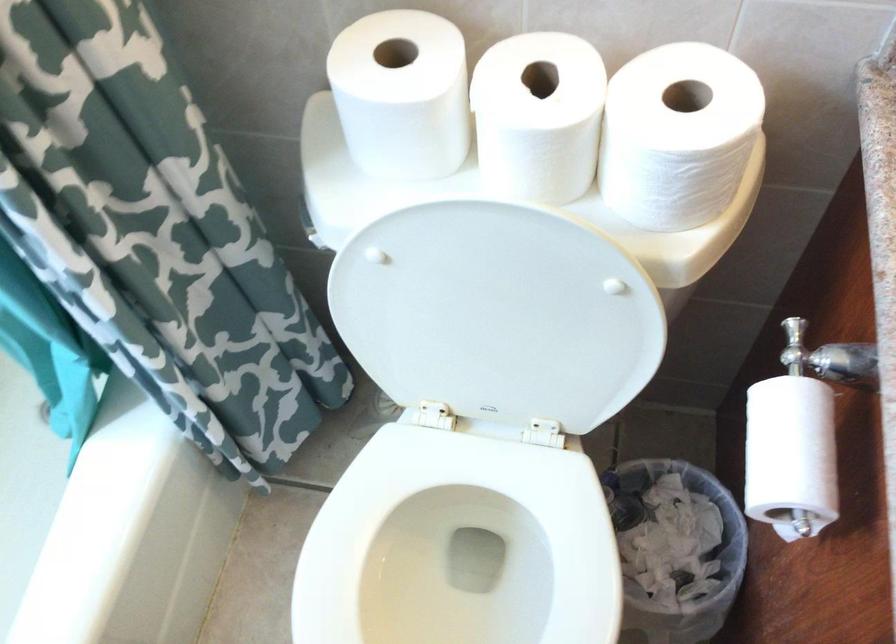
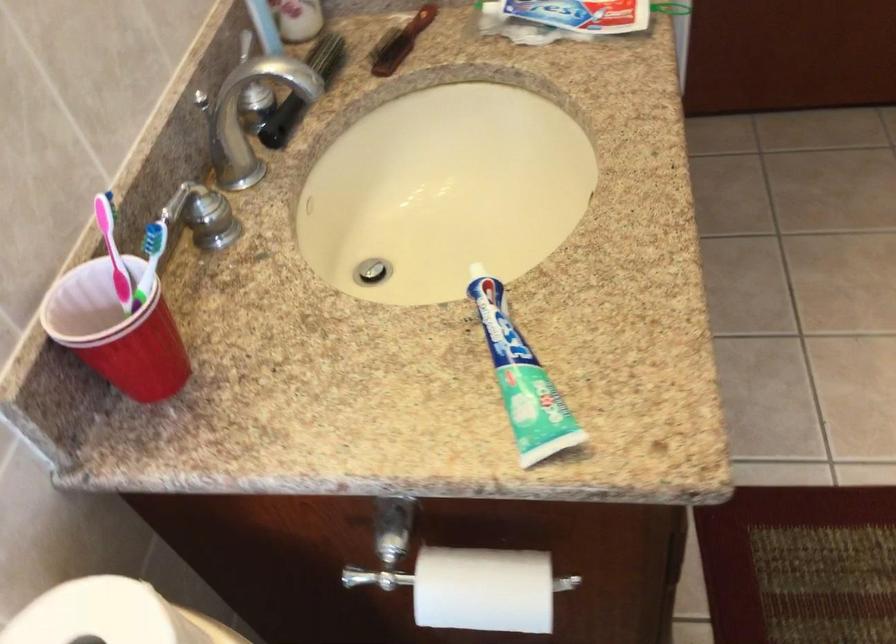
The point at (736, 109) is marked in the first image. Where is the corresponding point in the second image?

(101, 614)